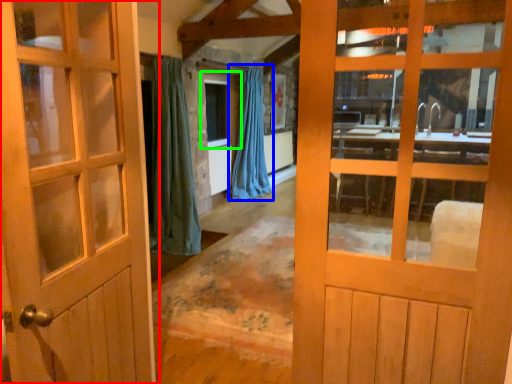
Question: Considering the real-world distances, which object is farthest from door (highlighted by a red box)? curtain (highlighted by a blue box) or window (highlighted by a green box)?

Choices:
 (A) curtain
 (B) window

Answer: (B)